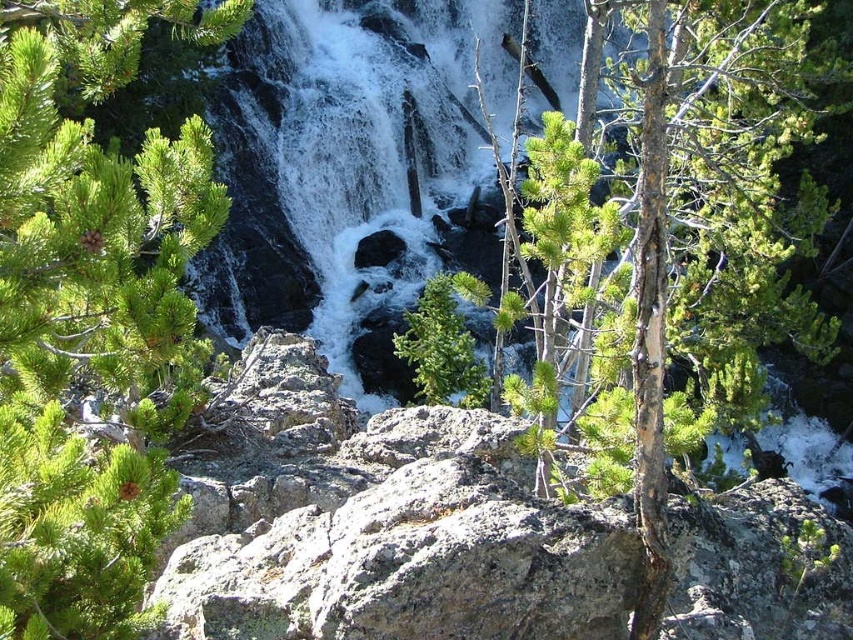
You are standing at the base of the waterfall and want to take a photo. There are two points marked in the scene, point 1 at coordinates point (202, 124) and point 2 at coordinates point (352, 1). Which point is closer to you, the observer?

Point (202, 124) is in front of point (352, 1), so it is closer to you.

You are standing at the base of the waterfall and notice two points marked in the image. The first point is at coordinates point (780, 116) and the second is at point (283, 138). Which of these two points is closer to you?

Point (780, 116) is in front of point (283, 138), so it is closer to you.